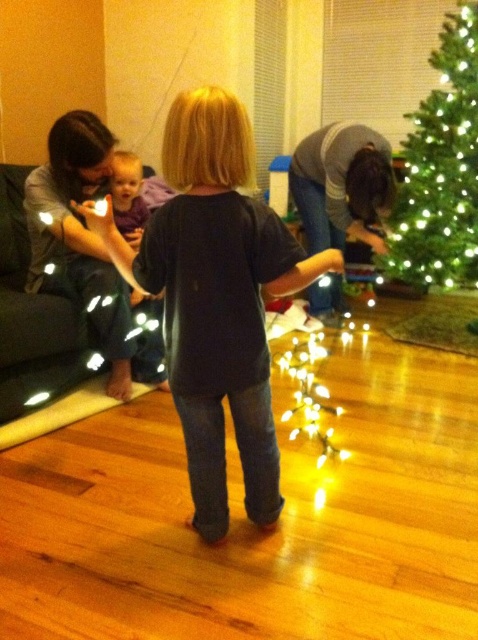
Question: Can you confirm if dark blue shirt at center is smaller than gray sweater at lower right?

Choices:
 (A) yes
 (B) no

Answer: (A)

Question: Which point is closer to the camera?

Choices:
 (A) illuminated string lights at lower center
 (B) matte purple shirt at upper left

Answer: (A)

Question: Which point is farther from the camera taking this photo?

Choices:
 (A) (113, 168)
 (B) (174, 224)
 (C) (71, 148)

Answer: (A)

Question: Is green matte christmas tree at right closer to the viewer compared to gray sweater at lower right?

Choices:
 (A) yes
 (B) no

Answer: (A)

Question: From the image, what is the correct spatial relationship of green matte christmas tree at right in relation to matte purple shirt at upper left?

Choices:
 (A) above
 (B) below

Answer: (A)

Question: Which object is closer to the camera taking this photo?

Choices:
 (A) green matte christmas tree at right
 (B) matte purple shirt at upper left
 (C) dark blue shirt at center

Answer: (C)